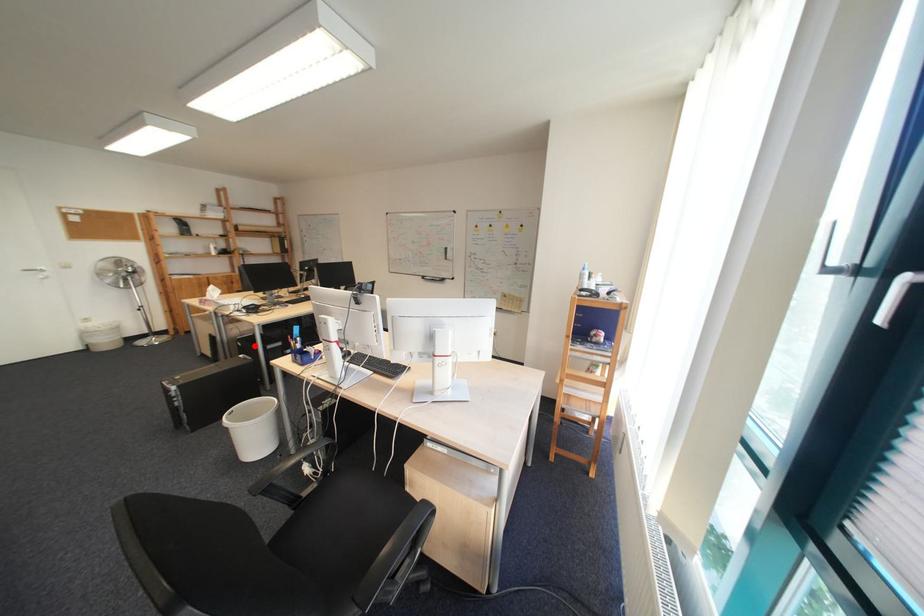
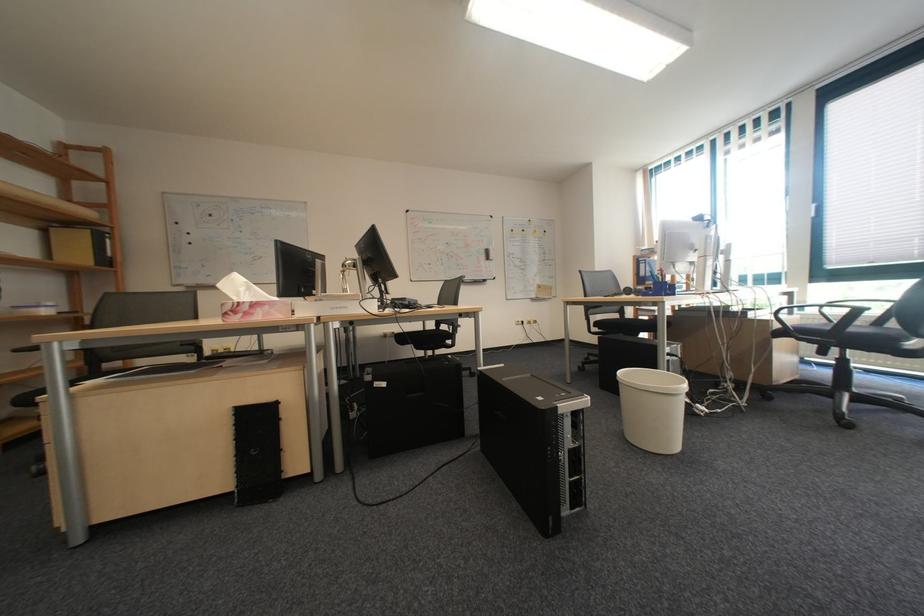
Question: I am providing you with two images of the same scene from different viewpoints. In image1, a red point is highlighted. Considering the same 3D point in image2, which of the following is correct?

Choices:
 (A) It is closer
 (B) It is farther

Answer: (B)